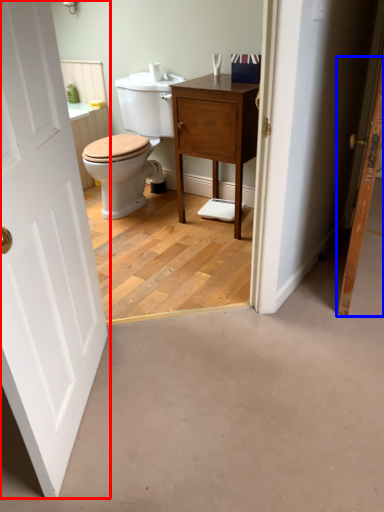
Question: Among these objects, which one is nearest to the camera, door (highlighted by a red box) or door (highlighted by a blue box)?

Choices:
 (A) door
 (B) door

Answer: (A)